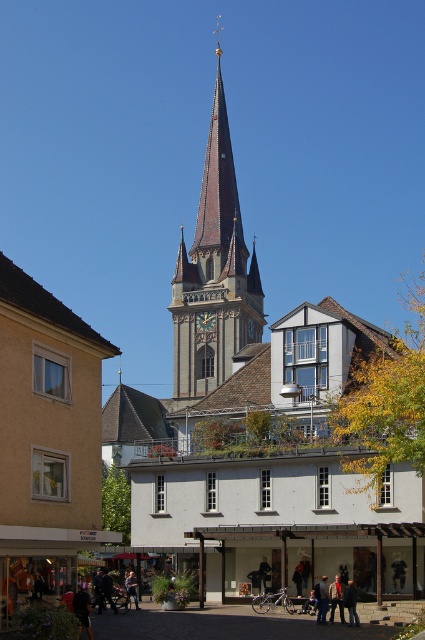
Question: Is the position of dark brown leather jacket at center more distant than that of dark blue jeans at center?

Choices:
 (A) yes
 (B) no

Answer: (B)

Question: Which object is the closest to the brown stone church at center?

Choices:
 (A) dark blue jeans at center
 (B) dark brown leather jacket at center
 (C) light brown leather jacket at center
 (D) gold textured clock at center

Answer: (C)

Question: Is dark brown leather jacket at center thinner than gold textured clock at center?

Choices:
 (A) no
 (B) yes

Answer: (A)

Question: Among these points, which one is farthest from the camera?

Choices:
 (A) (195, 320)
 (B) (248, 305)

Answer: (B)

Question: From the image, what is the correct spatial relationship of brown stone tower at center in relation to light brown leather jacket at center?

Choices:
 (A) right
 (B) left

Answer: (B)

Question: Which point appears closest to the camera in this image?

Choices:
 (A) (212, 179)
 (B) (342, 612)
 (C) (206, 312)
 (D) (257, 365)

Answer: (B)